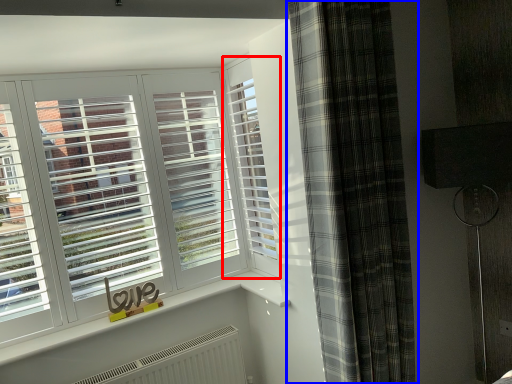
Question: Which point is closer to the camera, window (highlighted by a red box) or curtain (highlighted by a blue box)?

Choices:
 (A) window
 (B) curtain

Answer: (B)